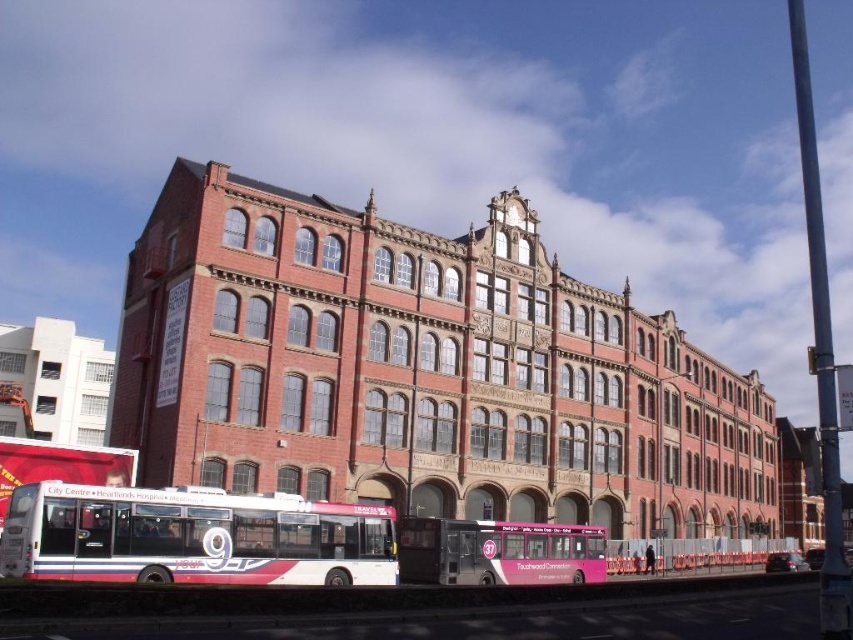
Can you confirm if white glossy bus at lower left is shorter than pink matte bus at center?

In fact, white glossy bus at lower left may be taller than pink matte bus at center.

Who is positioned more to the right, white glossy bus at lower left or pink matte bus at center?

From the viewer's perspective, pink matte bus at center appears more on the right side.

Describe the element at coordinates (194, 536) in the screenshot. I see `white glossy bus at lower left` at that location.

The height and width of the screenshot is (640, 853). Identify the location of white glossy bus at lower left. (194, 536).